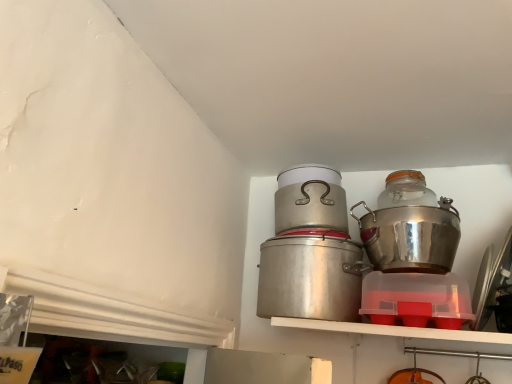
Question: Would you say shiny metallic pot at right, the first crock pot in the right-to-left sequence, is outside transparent glass jar at upper right?

Choices:
 (A) no
 (B) yes

Answer: (B)

Question: From the image's perspective, is shiny metallic pot at right, the 2th crock pot positioned from the left, on top of transparent glass jar at upper right?

Choices:
 (A) yes
 (B) no

Answer: (B)

Question: Does shiny metallic pot at right, the 2th crock pot positioned from the left, contain transparent glass jar at upper right?

Choices:
 (A) no
 (B) yes

Answer: (A)

Question: Considering the relative sizes of shiny metallic pot at right, the first crock pot in the right-to-left sequence, and transparent glass jar at upper right in the image provided, is shiny metallic pot at right, the first crock pot in the right-to-left sequence, smaller than transparent glass jar at upper right?

Choices:
 (A) no
 (B) yes

Answer: (A)

Question: Can you confirm if shiny metallic pot at right, the 2th crock pot positioned from the left, is wider than transparent glass jar at upper right?

Choices:
 (A) yes
 (B) no

Answer: (A)

Question: Is shiny metallic pot at right, the first crock pot in the right-to-left sequence, to the left or to the right of metallic silver pot at center in the image?

Choices:
 (A) right
 (B) left

Answer: (A)

Question: Looking at the image, does shiny metallic pot at right, the first crock pot in the right-to-left sequence, seem bigger or smaller compared to metallic silver pot at center?

Choices:
 (A) small
 (B) big

Answer: (B)

Question: From the image's perspective, is shiny metallic pot at right, the 2th crock pot positioned from the left, above or below metallic silver pot at center?

Choices:
 (A) below
 (B) above

Answer: (A)

Question: In terms of width, does shiny metallic pot at right, the 2th crock pot positioned from the left, look wider or thinner when compared to metallic silver pot at center?

Choices:
 (A) thin
 (B) wide

Answer: (B)

Question: In terms of height, does metallic silver pot at center look taller or shorter compared to silver metallic crock pot at center, the first crock pot viewed from the left?

Choices:
 (A) tall
 (B) short

Answer: (B)

Question: From the image's perspective, is metallic silver pot at center positioned above or below silver metallic crock pot at center, the 2th crock pot when ordered from right to left?

Choices:
 (A) above
 (B) below

Answer: (A)

Question: From a real-world perspective, relative to silver metallic crock pot at center, the first crock pot viewed from the left, is metallic silver pot at center vertically above or below?

Choices:
 (A) below
 (B) above

Answer: (B)

Question: Looking at their shapes, would you say metallic silver pot at center is wider or thinner than silver metallic crock pot at center, the first crock pot viewed from the left?

Choices:
 (A) thin
 (B) wide

Answer: (B)

Question: Is shiny metallic pot at right, the first crock pot in the right-to-left sequence, taller or shorter than transparent glass jar at upper right?

Choices:
 (A) short
 (B) tall

Answer: (B)

Question: From the image's perspective, relative to transparent glass jar at upper right, is shiny metallic pot at right, the 2th crock pot positioned from the left, above or below?

Choices:
 (A) below
 (B) above

Answer: (A)